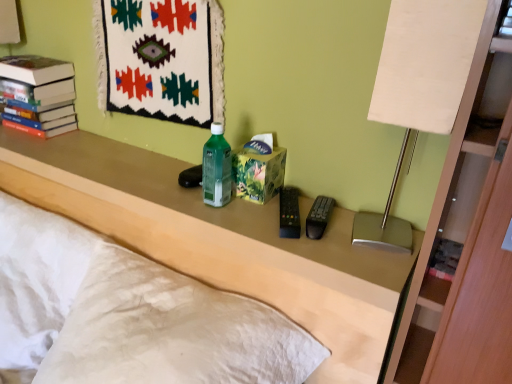
Locate an element on the screen. Image resolution: width=512 pixels, height=384 pixels. free region on the left part of matte beige table lamp at right is located at coordinates pos(317,242).